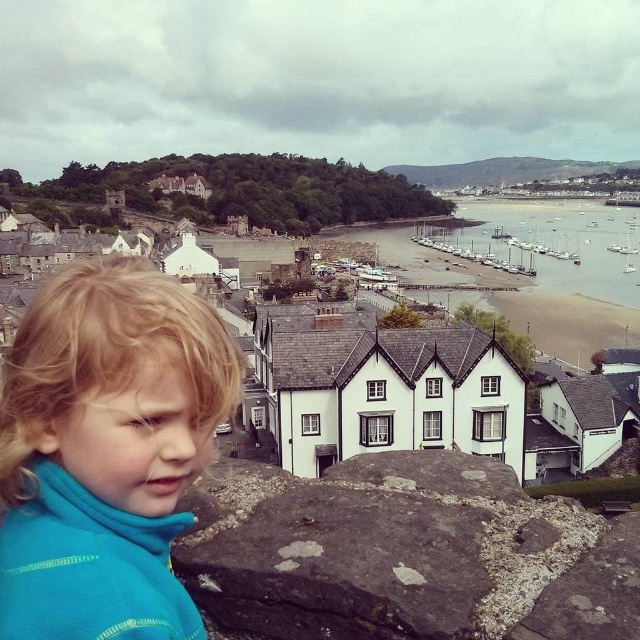
Which of these two, gray rough stone at lower left or white stone houses at center, stands taller?

white stone houses at center

Which of these two, gray rough stone at lower left or white stone houses at center, stands shorter?

gray rough stone at lower left

Is point (285, 499) farther from camera compared to point (390, 369)?

That is False.

Identify the location of gray rough stone at lower left. This screenshot has height=640, width=640. (404, 554).

Can you confirm if blue fleece jacket at lower left is bigger than white stone houses at center?

Incorrect, blue fleece jacket at lower left is not larger than white stone houses at center.

Is blue fleece jacket at lower left closer to the viewer compared to white stone houses at center?

Yes.

What are the coordinates of `blue fleece jacket at lower left` in the screenshot? It's located at (106, 452).

Can you confirm if gray rough stone at lower left is positioned below blue fleece jacket at lower left?

Correct, gray rough stone at lower left is located below blue fleece jacket at lower left.

The image size is (640, 640). Identify the location of gray rough stone at lower left. (404, 554).

Where is `gray rough stone at lower left`? gray rough stone at lower left is located at coordinates (404, 554).